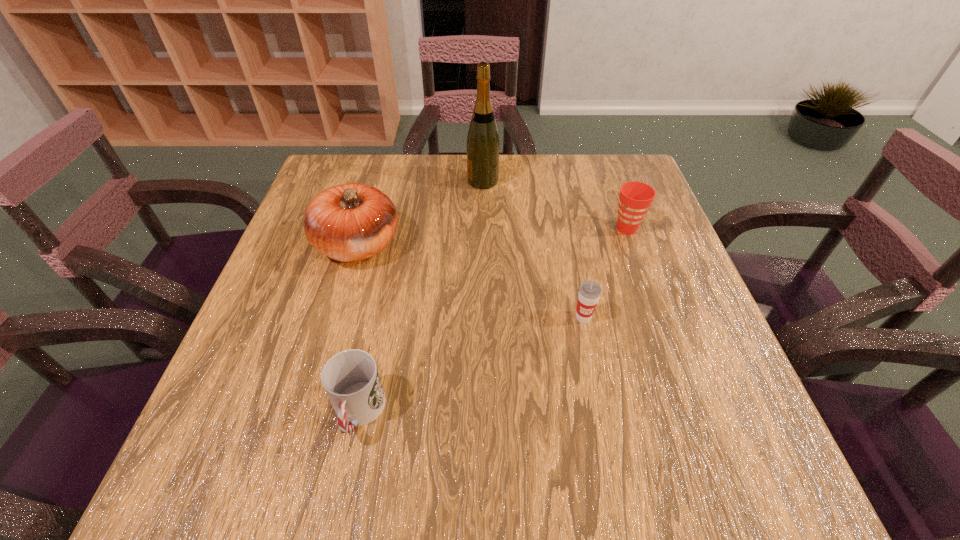
At what (x,y) coordinates should I click in order to perform the action: click on the farthest object. Please return your answer as a coordinate pair (x, y). This screenshot has height=540, width=960. Looking at the image, I should click on (483, 144).

You are a GUI agent. You are given a task and a screenshot of the screen. Output one action in this format:
    pyautogui.click(x=<x>, y=<y>)
    Task: Click on the tallest object
    The height and width of the screenshot is (540, 960).
    Given the screenshot: What is the action you would take?
    pyautogui.click(x=483, y=144)

Find the location of a particular element. This screenshot has width=960, height=540. the second tallest object is located at coordinates (350, 222).

Identify the location of the second cup from left to right. (589, 293).

The height and width of the screenshot is (540, 960). Find the location of `the second farthest cup`. the second farthest cup is located at coordinates (589, 293).

The image size is (960, 540). Find the location of `the rightmost cup`. the rightmost cup is located at coordinates (635, 198).

Locate an element on the screen. The image size is (960, 540). the rightmost object is located at coordinates pos(635,198).

This screenshot has height=540, width=960. Find the location of `the leftmost cup`. the leftmost cup is located at coordinates (351, 380).

Identify the location of the nearest cup. Image resolution: width=960 pixels, height=540 pixels. (351, 380).

This screenshot has width=960, height=540. I want to click on vacant area situated on the front-facing side of the wine bottle, so click(x=413, y=181).